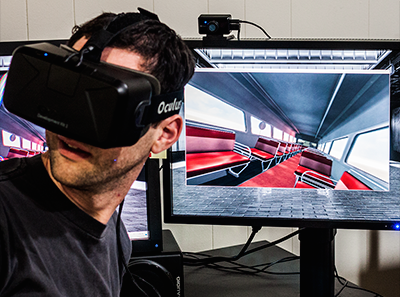
Where is `computer monitor stand`? This screenshot has width=400, height=297. computer monitor stand is located at coordinates (313, 242), (172, 259).